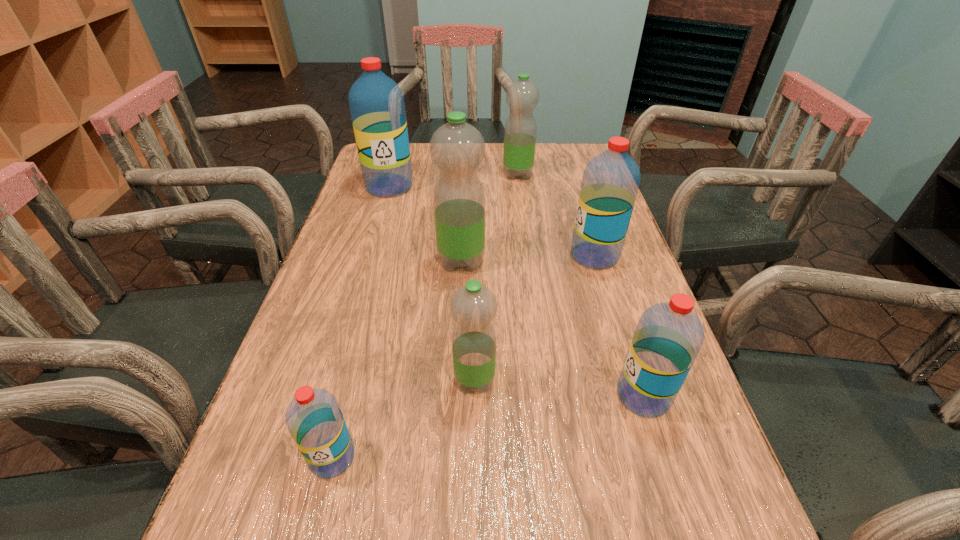
Image resolution: width=960 pixels, height=540 pixels. Find the location of `the farthest red water bottle`. the farthest red water bottle is located at coordinates (376, 102).

Identify the location of the second farthest green water bottle. (457, 148).

Image resolution: width=960 pixels, height=540 pixels. What are the coordinates of `the fifth object from left to right` in the screenshot? It's located at (522, 96).

The image size is (960, 540). What are the coordinates of `the farthest green water bottle` in the screenshot? It's located at (522, 96).

At what (x,y) coordinates should I click in order to perform the action: click on the second farthest red water bottle. Please return your answer as a coordinate pair (x, y). Looking at the image, I should click on (610, 183).

Locate an element on the screen. This screenshot has width=960, height=540. the nearest green water bottle is located at coordinates (473, 307).

In order to click on the second nearest red water bottle in this screenshot , I will do `click(668, 337)`.

The width and height of the screenshot is (960, 540). Identify the location of the smallest red water bottle. (313, 417).

Find the location of `the nearest object`. the nearest object is located at coordinates (313, 417).

Locate an element on the screen. vacant position located 0.260m on the front label of the biggest red water bottle is located at coordinates (369, 256).